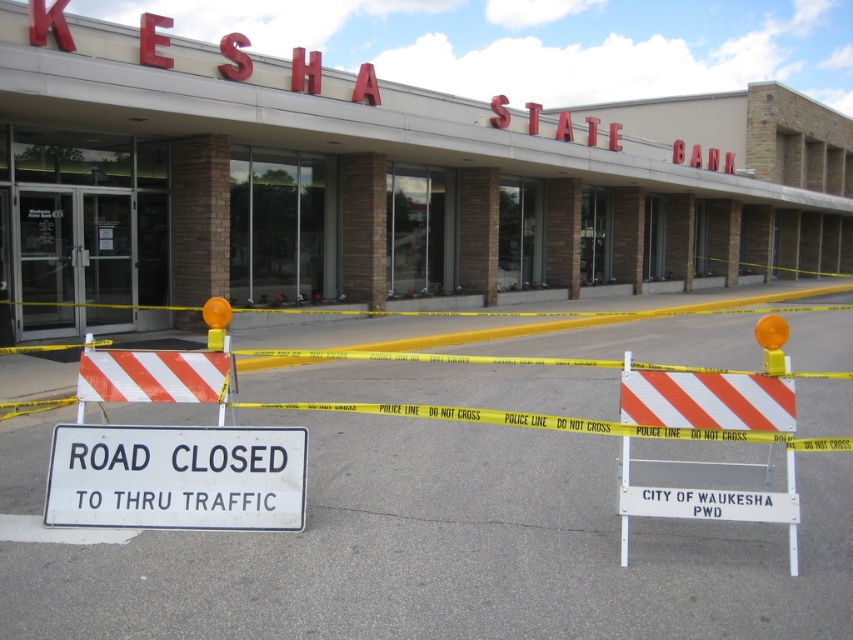
Question: Can you confirm if brick wall at center is smaller than white plastic sign at center?

Choices:
 (A) yes
 (B) no

Answer: (B)

Question: Which object is the closest to the white plastic sign at center?

Choices:
 (A) brick wall at center
 (B) white plastic barricade at center

Answer: (B)

Question: Which of these objects is positioned closest to the white plastic barricade at center?

Choices:
 (A) white plastic sign at center
 (B) brick wall at center

Answer: (A)

Question: From the image, what is the correct spatial relationship of white plastic sign at center in relation to white plastic barricade at center?

Choices:
 (A) right
 (B) left

Answer: (B)

Question: Which point is farther from the camera taking this photo?

Choices:
 (A) (119, 499)
 (B) (756, 429)

Answer: (A)

Question: Does white plastic sign at center appear on the right side of white plastic barricade at center?

Choices:
 (A) yes
 (B) no

Answer: (B)